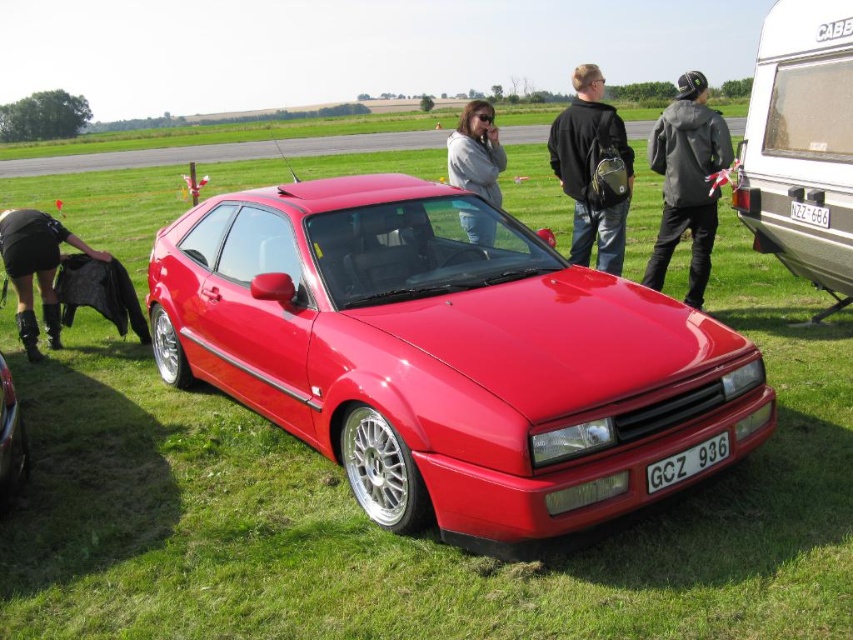
Question: Which point is farther to the camera?

Choices:
 (A) (804, 243)
 (B) (606, 115)

Answer: (B)

Question: Can you confirm if black leather jacket at lower left is positioned to the right of white plastic license plate at lower center?

Choices:
 (A) no
 (B) yes

Answer: (A)

Question: Which point is closer to the camera taking this photo?

Choices:
 (A) tap(612, 108)
 (B) tap(465, 168)
 (C) tap(44, 244)
 (D) tap(773, 84)

Answer: (D)

Question: Based on their relative distances, which object is nearer to the white plastic license plate at lower center?

Choices:
 (A) black leather jacket at lower left
 (B) white plastic trailer at right
 (C) suede gray jacket at upper center
 (D) shiny red car at center

Answer: (D)

Question: Can you confirm if suede gray jacket at upper center is bigger than shiny metallic car at center?

Choices:
 (A) yes
 (B) no

Answer: (B)

Question: Observing the image, what is the correct spatial positioning of black leather jacket at center in reference to shiny metallic car at center?

Choices:
 (A) right
 (B) left

Answer: (A)